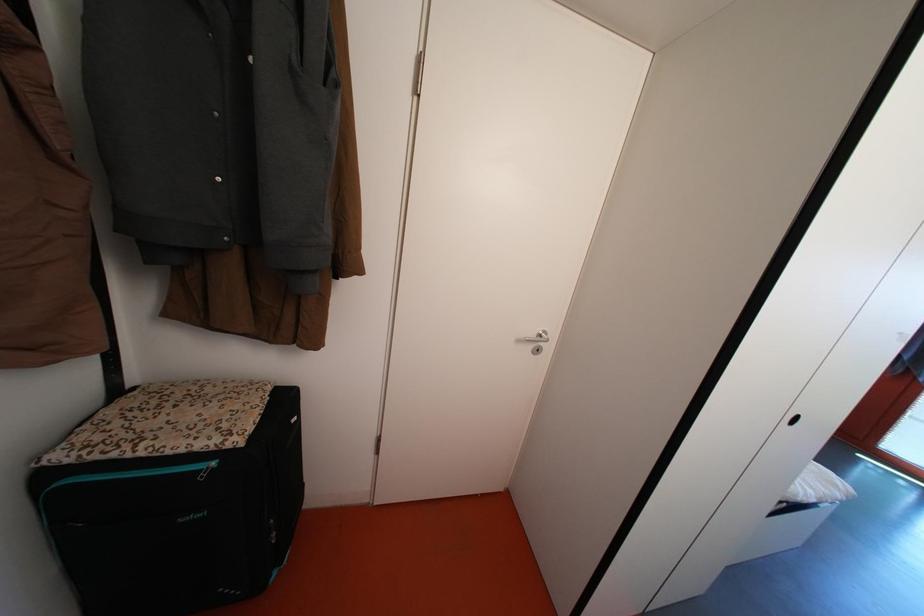
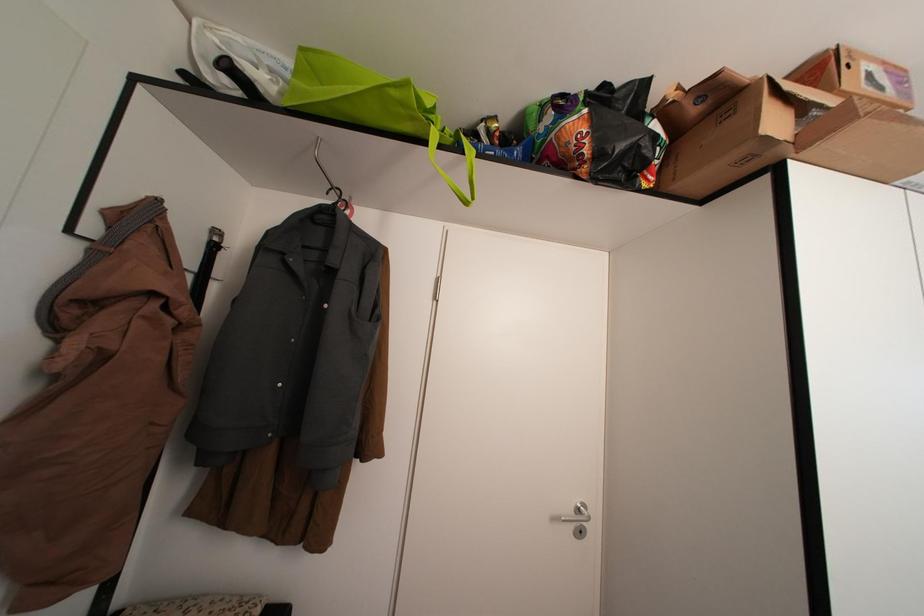
Question: The first image is from the beginning of the video and the second image is from the end. How did the camera likely rotate when shooting the video?

Choices:
 (A) Left
 (B) Right
 (C) Up
 (D) Down

Answer: (C)